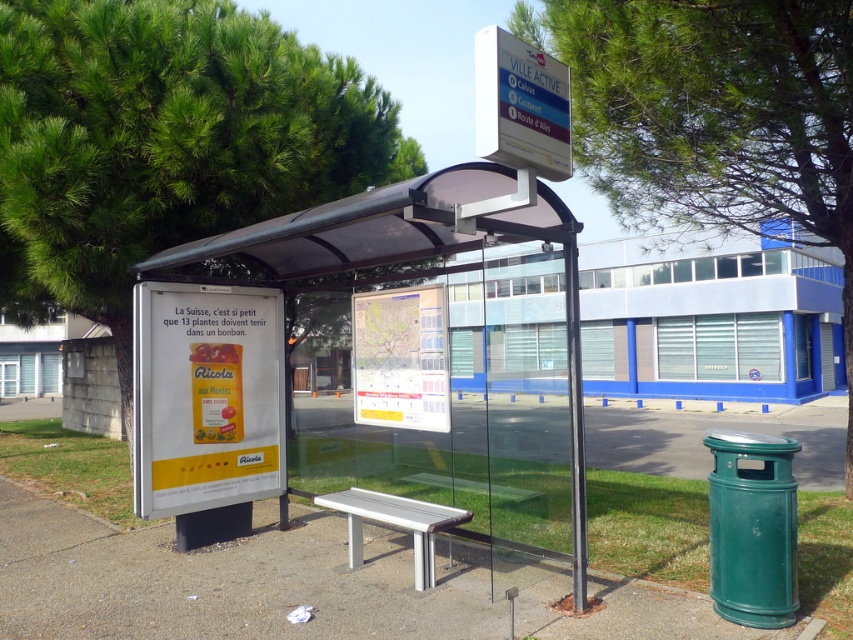
Is green leafy tree at upper center behind concrete bench at center?

Yes.

Identify the location of green leafy tree at upper center. Image resolution: width=853 pixels, height=640 pixels. (714, 116).

Find the location of a particular element. Image resolution: width=853 pixels, height=640 pixels. green leafy tree at upper center is located at coordinates (714, 116).

Does white plastic sign at upper center appear on the left side of silver metallic bench at center?

No, white plastic sign at upper center is not to the left of silver metallic bench at center.

Between point (540, 132) and point (396, 497), which one is positioned in front?

Positioned in front is point (540, 132).

The height and width of the screenshot is (640, 853). I want to click on white plastic sign at upper center, so coord(521,106).

The height and width of the screenshot is (640, 853). Describe the element at coordinates (164, 141) in the screenshot. I see `green leafy tree at upper left` at that location.

Can you confirm if green leafy tree at upper left is smaller than concrete bench at center?

No.

Who is more forward, (292, 189) or (42, 525)?

Point (42, 525) is in front.

I want to click on green leafy tree at upper left, so click(x=164, y=141).